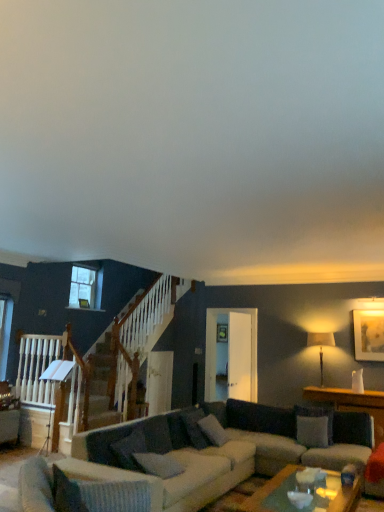
Question: Is white fabric pillow at center, which is the 1th pillow in back-to-front order, taller or shorter than clear glass window at upper left?

Choices:
 (A) short
 (B) tall

Answer: (A)

Question: Is white fabric pillow at center, which ranks as the 4th pillow in left-to-right order, in front of or behind clear glass window at upper left in the image?

Choices:
 (A) front
 (B) behind

Answer: (A)

Question: Considering the real-world distances, which object is closest to the white glossy door at center?

Choices:
 (A) gray fabric pillow at center, the 2th pillow viewed from the right
 (B) matte gold picture frame at upper right
 (C) wooden table at right
 (D) matte beige lampshade at right
 (E) textured gray couch at center

Answer: (D)

Question: Considering the real-world distances, which object is closest to the gray fabric pillow at center, which is counted as the 2th pillow, starting from the front?

Choices:
 (A) wooden table at right
 (B) matte gold picture frame at upper right
 (C) white fabric pillow at center, the fourth pillow in the front-to-back sequence
 (D) clear glass window at upper left
 (E) white textured pillow at lower left, acting as the 4th pillow starting from the back

Answer: (E)